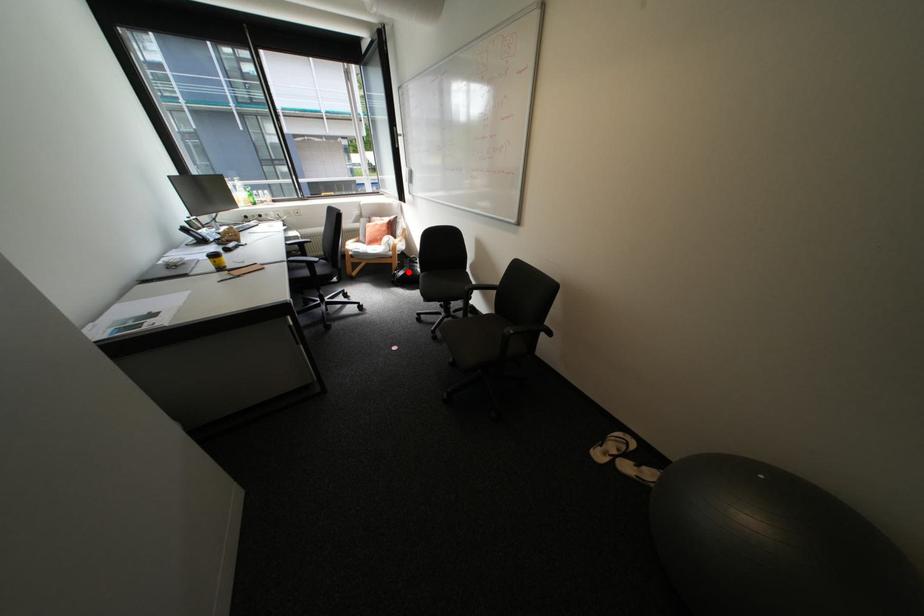
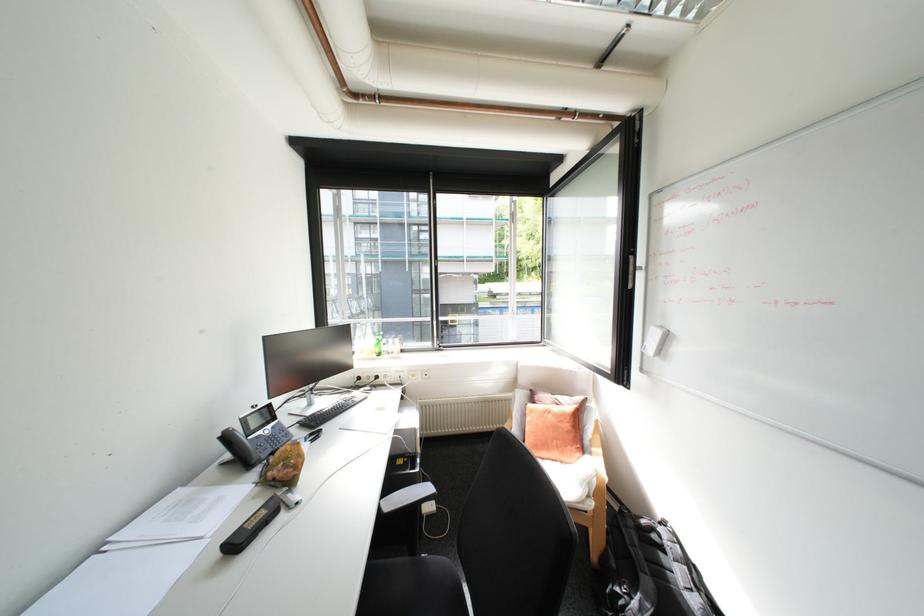
The point at the highlighted location is marked in the first image. Where is the corresponding point in the second image?

(640, 598)